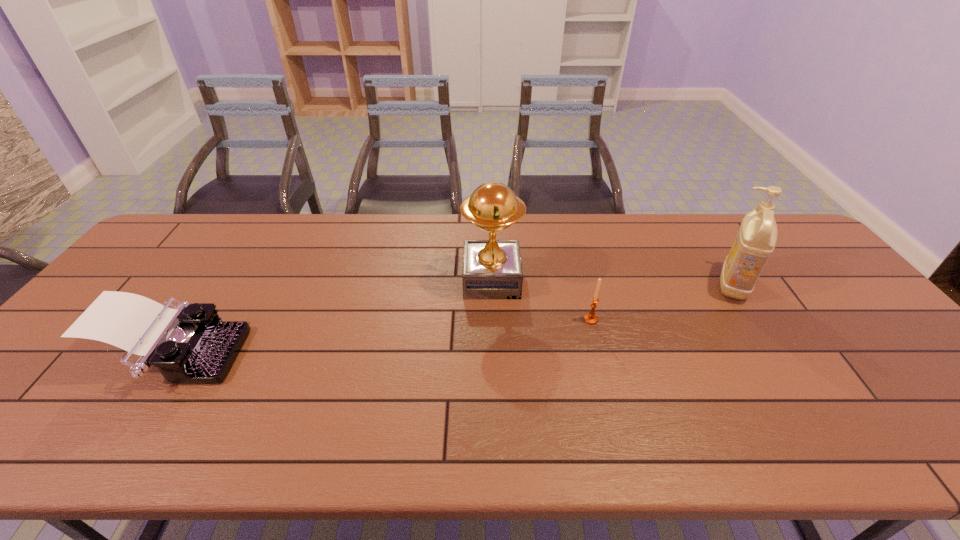
Locate an element on the screen. The width and height of the screenshot is (960, 540). the third object from right to left is located at coordinates (492, 269).

You are a GUI agent. You are given a task and a screenshot of the screen. Output one action in this format:
    pyautogui.click(x=<x>, y=<y>)
    Task: Click on the rightmost object
    This screenshot has width=960, height=540.
    Given the screenshot: What is the action you would take?
    pyautogui.click(x=755, y=242)

Identify the location of typewriter. The image size is (960, 540). (x=188, y=344).

The image size is (960, 540). Find the location of `the second object from right to left`. the second object from right to left is located at coordinates (591, 318).

Find the location of a particular element. The image size is (960, 540). vacant space positioned on the front-facing side of the third object from right to left is located at coordinates (391, 280).

I want to click on free space located on the front-facing side of the third object from right to left, so point(408,280).

This screenshot has width=960, height=540. Find the location of `vacant area situated on the front-facing side of the third object from right to left`. vacant area situated on the front-facing side of the third object from right to left is located at coordinates (401, 280).

Locate an element on the screen. vacant space situated 0.090m on the front of the detergent is located at coordinates (762, 329).

Locate an element on the screen. vacant space located 0.310m on the keys of the typewriter is located at coordinates (364, 357).

This screenshot has width=960, height=540. Find the location of `free space located on the right of the candle_holder`. free space located on the right of the candle_holder is located at coordinates tap(642, 320).